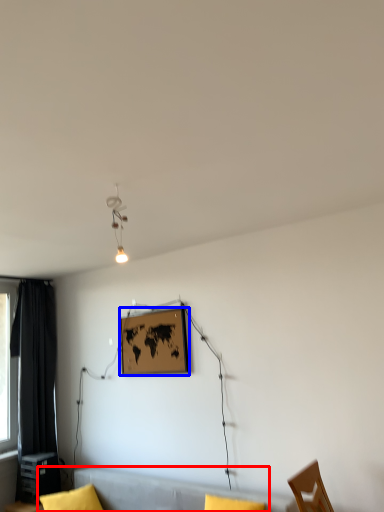
Question: Among these objects, which one is nearest to the camera, couch (highlighted by a red box) or picture frame (highlighted by a blue box)?

Choices:
 (A) couch
 (B) picture frame

Answer: (A)